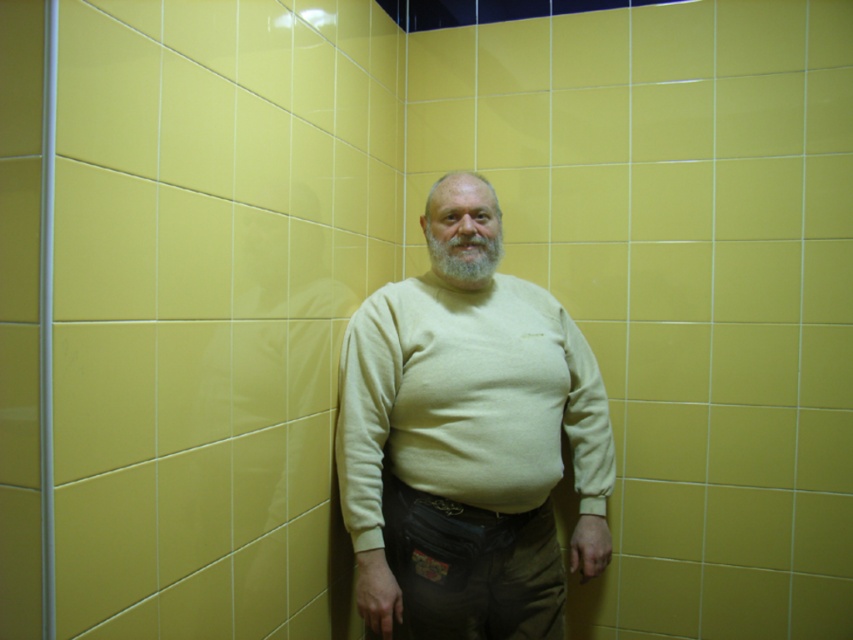
Question: Is beige cotton sweater at center to the left of gray matte beard at center from the viewer's perspective?

Choices:
 (A) yes
 (B) no

Answer: (B)

Question: Where is beige cotton sweater at center located in relation to gray matte beard at center in the image?

Choices:
 (A) right
 (B) left

Answer: (A)

Question: Which point is closer to the camera taking this photo?

Choices:
 (A) (479, 403)
 (B) (468, 278)

Answer: (A)

Question: Does beige cotton sweater at center come behind gray matte beard at center?

Choices:
 (A) yes
 (B) no

Answer: (B)

Question: Which point is closer to the camera?

Choices:
 (A) (424, 337)
 (B) (445, 268)

Answer: (A)